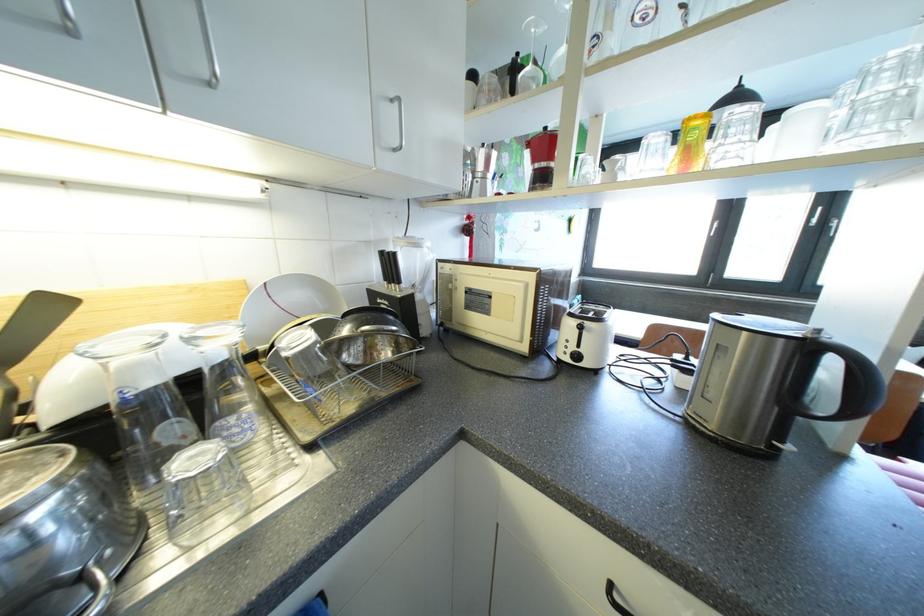
What do you see at coordinates (390, 265) in the screenshot? The width and height of the screenshot is (924, 616). I see `a black knife handle` at bounding box center [390, 265].